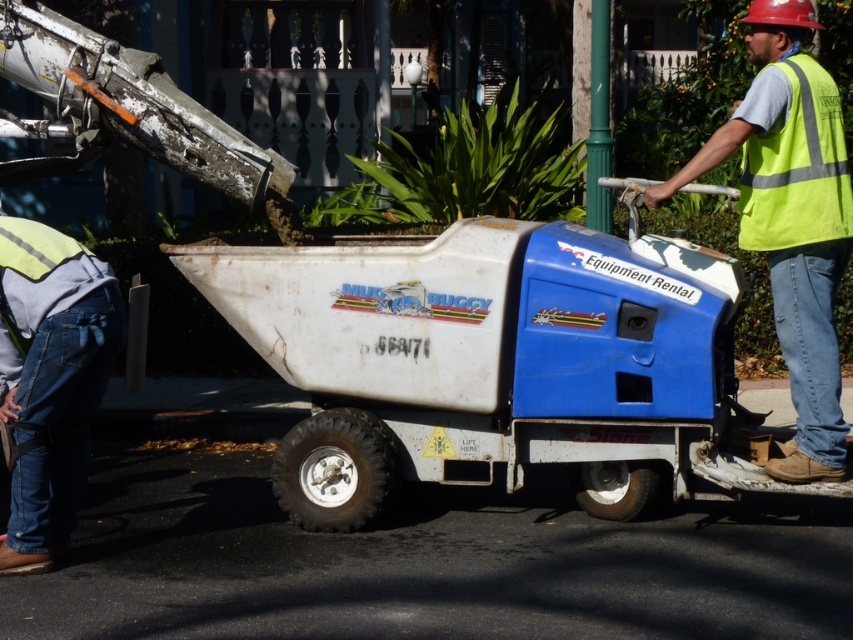
In the scene shown: You are a safety inspector reviewing the image. The safety protocol requires that the reflective yellow vest must be visible from all angles. Based on the scene, is the reflective yellow vest at right positioned in a way that it can be seen from the front and back of the denim jeans at lower left?

The reflective yellow vest at right is positioned to the right of denim jeans at lower left, so it is not directly in front or behind the denim jeans at lower left. Therefore, the vest may not be visible from all angles as required by the safety protocol.